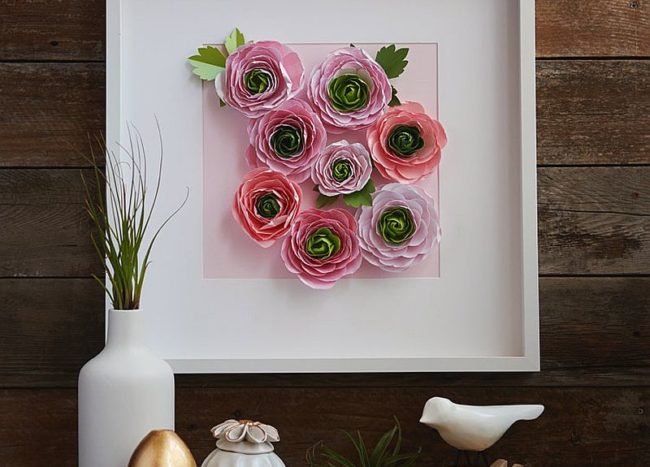
Locate an element on the screen. The width and height of the screenshot is (650, 467). wood wall background is located at coordinates (593, 82).